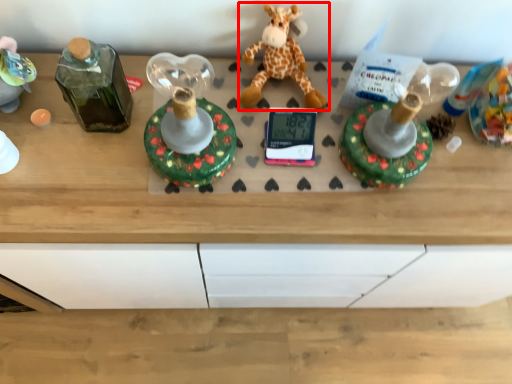
Question: Where is giraffe (annotated by the red box) located in relation to toy in the image?

Choices:
 (A) left
 (B) right

Answer: (B)